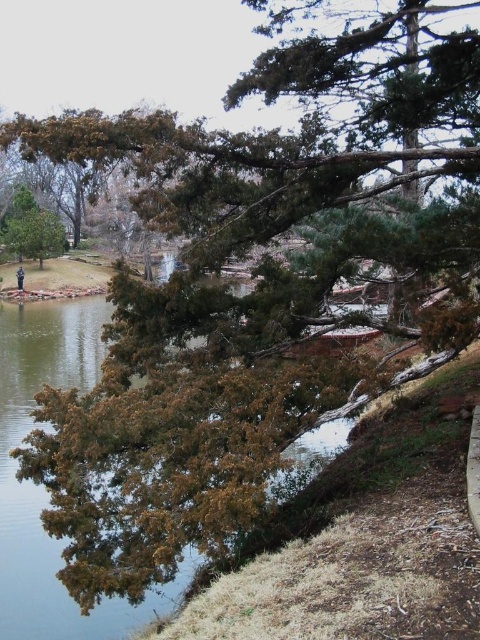
Question: Does green needle-like at center appear under clear water at lower left?

Choices:
 (A) no
 (B) yes

Answer: (A)

Question: Which point is closer to the camera?

Choices:
 (A) clear water at lower left
 (B) green needle-like at center
 (C) dark blue uniform at center

Answer: (A)

Question: Which object appears farthest from the camera in this image?

Choices:
 (A) green needle-like at center
 (B) clear water at lower left
 (C) dark blue uniform at center

Answer: (C)

Question: Does green needle-like at center appear on the left side of clear water at lower left?

Choices:
 (A) yes
 (B) no

Answer: (B)

Question: Observing the image, what is the correct spatial positioning of clear water at lower left in reference to dark blue uniform at center?

Choices:
 (A) above
 (B) below

Answer: (B)

Question: Which of the following is the closest to the observer?

Choices:
 (A) (130, 604)
 (B) (195, 211)
 (C) (20, 284)

Answer: (A)